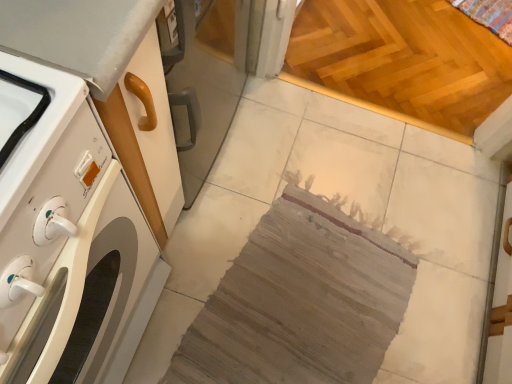
Question: Would you consider light brown wooden floor at upper right to be distant from woven fabric rug at center?

Choices:
 (A) no
 (B) yes

Answer: (A)

Question: Would you say light brown wooden floor at upper right contains woven fabric rug at center?

Choices:
 (A) yes
 (B) no

Answer: (B)

Question: Is light brown wooden floor at upper right turned away from woven fabric rug at center?

Choices:
 (A) yes
 (B) no

Answer: (B)

Question: Considering the relative sizes of light brown wooden floor at upper right and woven fabric rug at center in the image provided, is light brown wooden floor at upper right shorter than woven fabric rug at center?

Choices:
 (A) no
 (B) yes

Answer: (A)

Question: Considering the relative sizes of light brown wooden floor at upper right and woven fabric rug at center in the image provided, is light brown wooden floor at upper right taller than woven fabric rug at center?

Choices:
 (A) yes
 (B) no

Answer: (A)

Question: From a real-world perspective, is white glossy washing machine at left physically located above or below light brown wooden floor at upper right?

Choices:
 (A) below
 (B) above

Answer: (B)

Question: Relative to light brown wooden floor at upper right, is white glossy washing machine at left in front or behind?

Choices:
 (A) front
 (B) behind

Answer: (A)

Question: Looking at their shapes, would you say white glossy washing machine at left is wider or thinner than light brown wooden floor at upper right?

Choices:
 (A) wide
 (B) thin

Answer: (B)

Question: Considering the relative positions of white glossy washing machine at left and light brown wooden floor at upper right in the image provided, is white glossy washing machine at left to the left or to the right of light brown wooden floor at upper right?

Choices:
 (A) right
 (B) left

Answer: (B)

Question: Is light brown wooden floor at upper right bigger or smaller than woven fabric rug at center?

Choices:
 (A) big
 (B) small

Answer: (A)

Question: Relative to woven fabric rug at center, is light brown wooden floor at upper right in front or behind?

Choices:
 (A) behind
 (B) front

Answer: (A)

Question: From the image's perspective, is light brown wooden floor at upper right above or below woven fabric rug at center?

Choices:
 (A) above
 (B) below

Answer: (A)

Question: Is light brown wooden floor at upper right wider or thinner than woven fabric rug at center?

Choices:
 (A) wide
 (B) thin

Answer: (A)

Question: From a real-world perspective, relative to light brown wooden floor at upper right, is woven fabric rug at center vertically above or below?

Choices:
 (A) below
 (B) above

Answer: (B)

Question: Is woven fabric rug at center taller or shorter than light brown wooden floor at upper right?

Choices:
 (A) short
 (B) tall

Answer: (A)